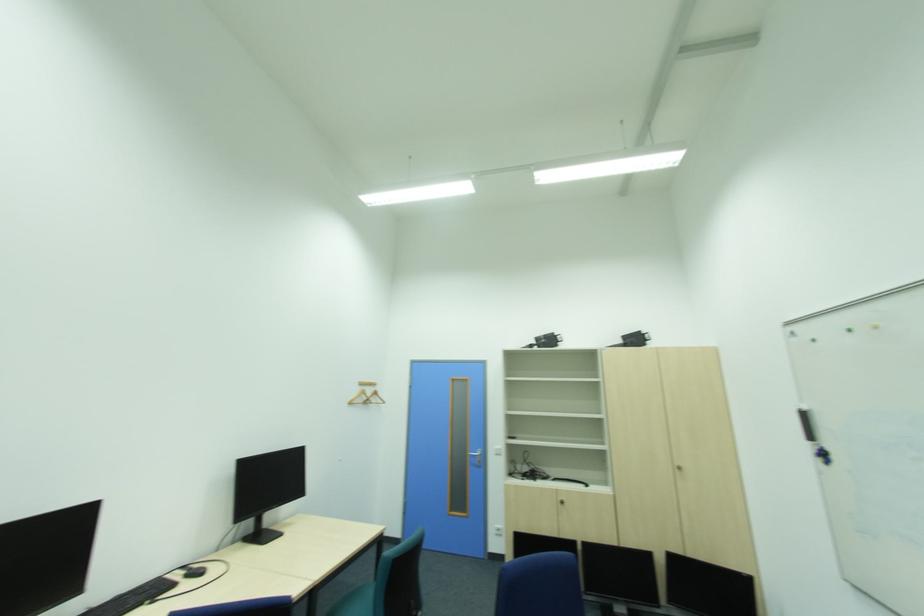
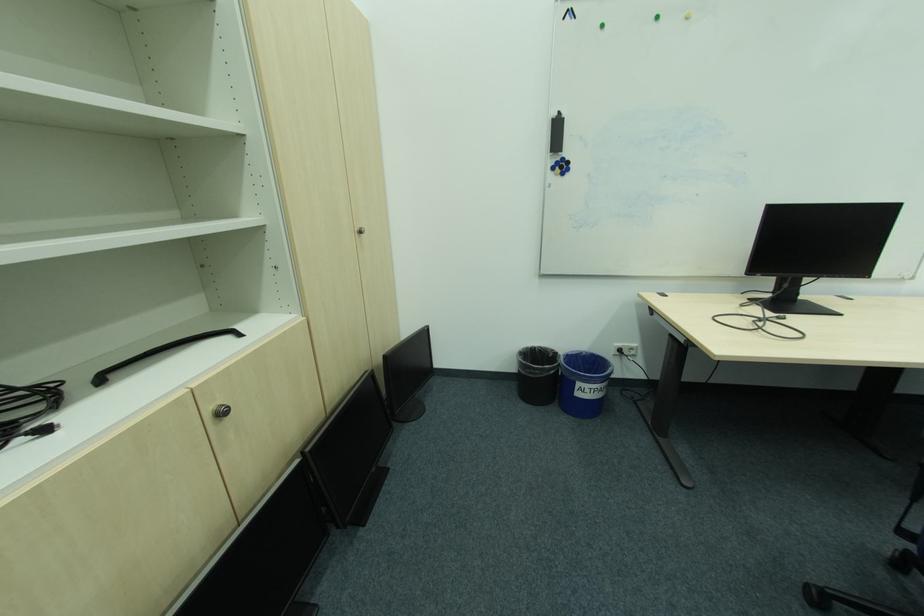
Question: I am providing you with two images of the same scene from different viewpoints. Please identify which objects are invisible in image2.

Choices:
 (A) black computer monitor
 (B) blue trash bin
 (C) black trash bin
 (D) none of these

Answer: (D)